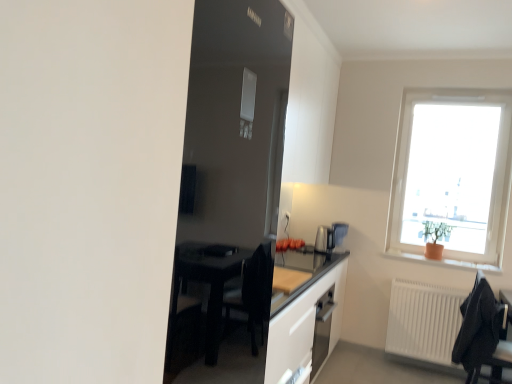
Image resolution: width=512 pixels, height=384 pixels. Find the location of `transparent glass window at upper right`. transparent glass window at upper right is located at coordinates (452, 176).

What do you see at coordinates (482, 333) in the screenshot? The height and width of the screenshot is (384, 512). I see `black fabric chair at lower right` at bounding box center [482, 333].

What are the coordinates of `orange clay pot at right` in the screenshot? It's located at (445, 261).

At what (x,y) coordinates should I click in order to perform the action: click on transparent glass window at upper right. Please return your answer as a coordinate pair (x, y). The width and height of the screenshot is (512, 384). Looking at the image, I should click on (452, 176).

Can you confirm if glossy black table at center is wider than white matte radiator at lower right?

Indeed, glossy black table at center has a greater width compared to white matte radiator at lower right.

Is glossy black table at center to the left of white matte radiator at lower right from the viewer's perspective?

Yes, glossy black table at center is to the left of white matte radiator at lower right.

What's the angular difference between glossy black table at center and white matte radiator at lower right's facing directions?

The angle between the facing direction of glossy black table at center and the facing direction of white matte radiator at lower right is 89.3 degrees.

From the image's perspective, which one is positioned higher, glossy black table at center or white matte radiator at lower right?

glossy black table at center, from the image's perspective.

Find the location of a particular element. This screenshot has height=384, width=512. chair below the transparent glass window at upper right (from the image's perspective) is located at coordinates (482, 333).

Which object is thinner, transparent glass window at upper right or black fabric chair at lower right?

With smaller width is transparent glass window at upper right.

Would you say transparent glass window at upper right is inside or outside black fabric chair at lower right?

transparent glass window at upper right lies outside black fabric chair at lower right.

Is the position of satin metallic coffee machine at right more distant than that of glossy black table at center?

Yes.

Based on the photo, from the image's perspective, between satin metallic coffee machine at right and glossy black table at center, who is located below?

glossy black table at center, from the image's perspective.

Choose the correct answer: Is satin metallic coffee machine at right inside glossy black table at center or outside it?

satin metallic coffee machine at right lies outside glossy black table at center.

In terms of width, does white matte radiator at lower right look wider or thinner when compared to black fabric chair at lower right?

Considering their sizes, white matte radiator at lower right looks slimmer than black fabric chair at lower right.

From the picture: Is white matte radiator at lower right touching black fabric chair at lower right?

No.

I want to click on radiator to the left of black fabric chair at lower right, so click(424, 321).

Considering the relative sizes of satin metallic coffee machine at right and orange clay pot at right in the image provided, is satin metallic coffee machine at right bigger than orange clay pot at right?

Actually, satin metallic coffee machine at right might be smaller than orange clay pot at right.

Is satin metallic coffee machine at right positioned behind orange clay pot at right?

Yes, satin metallic coffee machine at right is behind orange clay pot at right.

Is satin metallic coffee machine at right facing towards orange clay pot at right?

No, satin metallic coffee machine at right is not oriented towards orange clay pot at right.

Considering the positions of objects white matte radiator at lower right and satin metallic coffee machine at right in the image provided, who is more to the right, white matte radiator at lower right or satin metallic coffee machine at right?

From the viewer's perspective, white matte radiator at lower right appears more on the right side.

Is satin metallic coffee machine at right a part of white matte radiator at lower right?

No.

From the image's perspective, is white matte radiator at lower right on satin metallic coffee machine at right?

No.

In the scene shown: Could you tell me if white matte radiator at lower right is turned towards glossy black table at center?

No, white matte radiator at lower right is not oriented towards glossy black table at center.

Considering the sizes of objects white matte radiator at lower right and glossy black table at center in the image provided, who is bigger, white matte radiator at lower right or glossy black table at center?

With larger size is glossy black table at center.

From a real-world perspective, is white matte radiator at lower right above or below glossy black table at center?

white matte radiator at lower right is situated lower than glossy black table at center in the real world.

Image resolution: width=512 pixels, height=384 pixels. Identify the location of radiator below the glossy black table at center (from the image's perspective). (424, 321).

This screenshot has height=384, width=512. Identify the location of window above the black fabric chair at lower right (from a real-world perspective). (452, 176).

From the image, which object appears to be farther from satin metallic coffee machine at right, white matte radiator at lower right or glossy black table at center?

white matte radiator at lower right is further to satin metallic coffee machine at right.

Considering their positions, is glossy black table at center positioned closer to transparent glass window at upper right than black fabric chair at lower right?

Among the two, black fabric chair at lower right is located nearer to transparent glass window at upper right.

From the image, which object appears to be nearer to black fabric chair at lower right, orange clay pot at right or white matte radiator at lower right?

white matte radiator at lower right is closer to black fabric chair at lower right.

Based on their spatial positions, is glossy black table at center or black fabric chair at lower right closer to white matte radiator at lower right?

black fabric chair at lower right is closer to white matte radiator at lower right.

When comparing their distances from transparent glass window at upper right, does black fabric chair at lower right or satin metallic coffee machine at right seem closer?

black fabric chair at lower right lies closer to transparent glass window at upper right than the other object.

Estimate the real-world distances between objects in this image. Which object is further from black fabric chair at lower right, white matte radiator at lower right or transparent glass window at upper right?

transparent glass window at upper right.

Based on their spatial positions, is glossy black table at center or black fabric chair at lower right closer to orange clay pot at right?

The object closer to orange clay pot at right is black fabric chair at lower right.

Looking at the image, which one is located further to satin metallic coffee machine at right, white matte radiator at lower right or orange clay pot at right?

white matte radiator at lower right.

Where is `window sill between transparent glass window at upper right and black fabric chair at lower right in the vertical direction`? window sill between transparent glass window at upper right and black fabric chair at lower right in the vertical direction is located at coordinates (445, 261).

The image size is (512, 384). I want to click on radiator between glossy black table at center and black fabric chair at lower right from left to right, so coord(424,321).

In order to click on radiator between glossy black table at center and satin metallic coffee machine at right in the front-back direction in this screenshot , I will do `click(424, 321)`.

Identify the location of chair between transparent glass window at upper right and white matte radiator at lower right in the vertical direction. (482, 333).